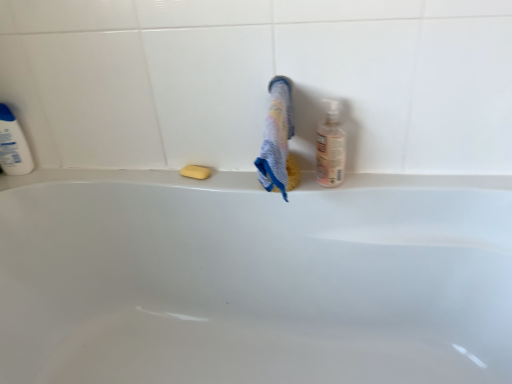
Locate an element on the screen. Image resolution: width=512 pixels, height=384 pixels. white glossy bathtub at center is located at coordinates (254, 279).

What do you see at coordinates (13, 145) in the screenshot?
I see `white plastic bottle at left, the first cleaning product positioned from the back` at bounding box center [13, 145].

Locate an element on the screen. This screenshot has height=384, width=512. translucent plastic bottle at right, arranged as the 2th cleaning product when viewed from the back is located at coordinates (330, 148).

Considering the sizes of multicolored textured towel at center and translucent plastic bottle at right, arranged as the 2th cleaning product when viewed from the back, in the image, is multicolored textured towel at center bigger or smaller than translucent plastic bottle at right, arranged as the 2th cleaning product when viewed from the back,?

In the image, multicolored textured towel at center appears to be larger than translucent plastic bottle at right, arranged as the 2th cleaning product when viewed from the back.

Is multicolored textured towel at center far from translucent plastic bottle at right, which is counted as the first cleaning product, starting from the front?

No.

Is multicolored textured towel at center positioned with its back to translucent plastic bottle at right, arranged as the 2th cleaning product when viewed from the back?

multicolored textured towel at center is not turned away from translucent plastic bottle at right, arranged as the 2th cleaning product when viewed from the back.

In the scene shown: Is translucent plastic bottle at right, which is counted as the first cleaning product, starting from the front, surrounded by multicolored textured towel at center?

That's incorrect, translucent plastic bottle at right, which is counted as the first cleaning product, starting from the front, is not inside multicolored textured towel at center.

Is white plastic bottle at left, the first cleaning product positioned from the back, to the right of yellow matte soap at center from the viewer's perspective?

In fact, white plastic bottle at left, the first cleaning product positioned from the back, is to the left of yellow matte soap at center.

From a real-world perspective, which is physically above, white plastic bottle at left, the 2th cleaning product in the right-to-left sequence, or yellow matte soap at center?

From a 3D spatial view, white plastic bottle at left, the 2th cleaning product in the right-to-left sequence, is above.

Which of these two, white plastic bottle at left, the first cleaning product positioned from the back, or yellow matte soap at center, is thinner?

white plastic bottle at left, the first cleaning product positioned from the back.

Identify the location of cleaning product on the left of yellow matte soap at center. The width and height of the screenshot is (512, 384). pyautogui.click(x=13, y=145).

Is multicolored textured towel at center oriented towards white glossy bathtub at center?

No, multicolored textured towel at center is not oriented towards white glossy bathtub at center.

Would you consider multicolored textured towel at center to be distant from white glossy bathtub at center?

No.

Considering the positions of objects multicolored textured towel at center and white glossy bathtub at center in the image provided, who is in front, multicolored textured towel at center or white glossy bathtub at center?

Positioned in front is white glossy bathtub at center.

From the image's perspective, is multicolored textured towel at center under white glossy bathtub at center?

No.

Could you tell me if translucent plastic bottle at right, the 1th cleaning product viewed from the right, is turned towards yellow matte soap at center?

No, translucent plastic bottle at right, the 1th cleaning product viewed from the right, is not turned towards yellow matte soap at center.

How many degrees apart are the facing directions of translucent plastic bottle at right, the 1th cleaning product viewed from the right, and yellow matte soap at center?

translucent plastic bottle at right, the 1th cleaning product viewed from the right, and yellow matte soap at center are facing 0.00408 degrees away from each other.

Between translucent plastic bottle at right, the 2th cleaning product in the left-to-right sequence, and yellow matte soap at center, which one has larger width?

Wider between the two is translucent plastic bottle at right, the 2th cleaning product in the left-to-right sequence.

Does translucent plastic bottle at right, the 1th cleaning product viewed from the right, come in front of yellow matte soap at center?

Yes, translucent plastic bottle at right, the 1th cleaning product viewed from the right, is closer to the camera.

Is white plastic bottle at left, the 2th cleaning product in the right-to-left sequence, surrounding translucent plastic bottle at right, the 1th cleaning product viewed from the right?

No, white plastic bottle at left, the 2th cleaning product in the right-to-left sequence, does not contain translucent plastic bottle at right, the 1th cleaning product viewed from the right.

Which object is positioned more to the left, white plastic bottle at left, the 2th cleaning product in the right-to-left sequence, or translucent plastic bottle at right, arranged as the 2th cleaning product when viewed from the back?

white plastic bottle at left, the 2th cleaning product in the right-to-left sequence, is more to the left.

Is white plastic bottle at left, the first cleaning product positioned from the back, oriented towards translucent plastic bottle at right, the 2th cleaning product in the left-to-right sequence?

No, white plastic bottle at left, the first cleaning product positioned from the back, does not turn towards translucent plastic bottle at right, the 2th cleaning product in the left-to-right sequence.

Consider the image. Considering the positions of objects white glossy bathtub at center and white plastic bottle at left, the first cleaning product viewed from the left, in the image provided, who is in front, white glossy bathtub at center or white plastic bottle at left, the first cleaning product viewed from the left,?

white glossy bathtub at center.

From their relative heights in the image, would you say white glossy bathtub at center is taller or shorter than white plastic bottle at left, the first cleaning product positioned from the back?

In the image, white glossy bathtub at center appears to be taller than white plastic bottle at left, the first cleaning product positioned from the back.

Does point (128, 187) lie behind point (13, 170)?

No, (128, 187) is closer to viewer.

Is white glossy bathtub at center positioned far away from white plastic bottle at left, the 2th cleaning product in the front-to-back sequence?

white glossy bathtub at center is near white plastic bottle at left, the 2th cleaning product in the front-to-back sequence, not far away.

Which is behind, point (344, 142) or point (18, 145)?

Point (18, 145)

Is translucent plastic bottle at right, the 2th cleaning product in the left-to-right sequence, to the right of white plastic bottle at left, the first cleaning product positioned from the back, from the viewer's perspective?

Yes.

I want to click on cleaning product lying on the left of translucent plastic bottle at right, which is counted as the first cleaning product, starting from the front, so click(x=13, y=145).

Consider the image. Are translucent plastic bottle at right, which is counted as the first cleaning product, starting from the front, and white plastic bottle at left, the 2th cleaning product in the front-to-back sequence, located far from each other?

They are positioned close to each other.

Locate an element on the screen. The height and width of the screenshot is (384, 512). cleaning product to the right of multicolored textured towel at center is located at coordinates (330, 148).

The width and height of the screenshot is (512, 384). In the image, there is a white plastic bottle at left, the first cleaning product viewed from the left. In order to click on soap below it (from a real-world perspective) in this screenshot , I will do `click(196, 172)`.

Which object lies nearer to the anchor point translucent plastic bottle at right, which is counted as the first cleaning product, starting from the front, multicolored textured towel at center or yellow matte soap at center?

Based on the image, multicolored textured towel at center appears to be nearer to translucent plastic bottle at right, which is counted as the first cleaning product, starting from the front.

Looking at this image, which object lies nearer to the anchor point white glossy bathtub at center, white plastic bottle at left, the 2th cleaning product in the right-to-left sequence, or yellow matte soap at center?

Among the two, yellow matte soap at center is located nearer to white glossy bathtub at center.

Considering their positions, is white glossy bathtub at center positioned further to yellow matte soap at center than translucent plastic bottle at right, which is counted as the first cleaning product, starting from the front?

white glossy bathtub at center lies further to yellow matte soap at center than the other object.

Which object lies nearer to the anchor point translucent plastic bottle at right, arranged as the 2th cleaning product when viewed from the back, white plastic bottle at left, the first cleaning product viewed from the left, or yellow matte soap at center?

yellow matte soap at center.

Based on their spatial positions, is white plastic bottle at left, the first cleaning product positioned from the back, or white glossy bathtub at center further from yellow matte soap at center?

white plastic bottle at left, the first cleaning product positioned from the back, is positioned further to the anchor yellow matte soap at center.

When comparing their distances from multicolored textured towel at center, does yellow matte soap at center or translucent plastic bottle at right, the 2th cleaning product in the left-to-right sequence, seem closer?

translucent plastic bottle at right, the 2th cleaning product in the left-to-right sequence, lies closer to multicolored textured towel at center than the other object.

In the scene shown: Which object lies nearer to the anchor point translucent plastic bottle at right, the 2th cleaning product in the left-to-right sequence, yellow matte soap at center or white glossy bathtub at center?

Based on the image, yellow matte soap at center appears to be nearer to translucent plastic bottle at right, the 2th cleaning product in the left-to-right sequence.

Looking at the image, which one is located further to white plastic bottle at left, the first cleaning product positioned from the back, yellow matte soap at center or multicolored textured towel at center?

multicolored textured towel at center is further to white plastic bottle at left, the first cleaning product positioned from the back.

Locate an element on the screen. The width and height of the screenshot is (512, 384). bathtub located between white plastic bottle at left, the 2th cleaning product in the front-to-back sequence, and translucent plastic bottle at right, which is counted as the first cleaning product, starting from the front, in the left-right direction is located at coordinates point(254,279).

Locate an element on the screen. This screenshot has width=512, height=384. bathtub located between white plastic bottle at left, the 2th cleaning product in the front-to-back sequence, and multicolored textured towel at center in the left-right direction is located at coordinates (254, 279).

Find the location of a particular element. The image size is (512, 384). bath towel between white glossy bathtub at center and yellow matte soap at center in the front-back direction is located at coordinates (276, 137).

This screenshot has width=512, height=384. I want to click on cleaning product that lies between multicolored textured towel at center and white glossy bathtub at center from top to bottom, so click(330, 148).